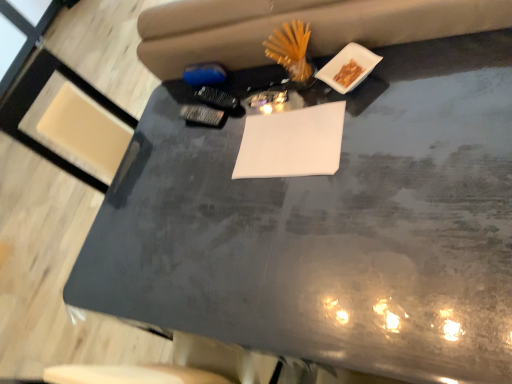
The image size is (512, 384). What do you see at coordinates (292, 143) in the screenshot?
I see `white paper at center` at bounding box center [292, 143].

This screenshot has height=384, width=512. Find the location of `white paper at center`. white paper at center is located at coordinates pyautogui.click(x=292, y=143).

Identify the location of white paper at center. The image size is (512, 384). click(x=292, y=143).